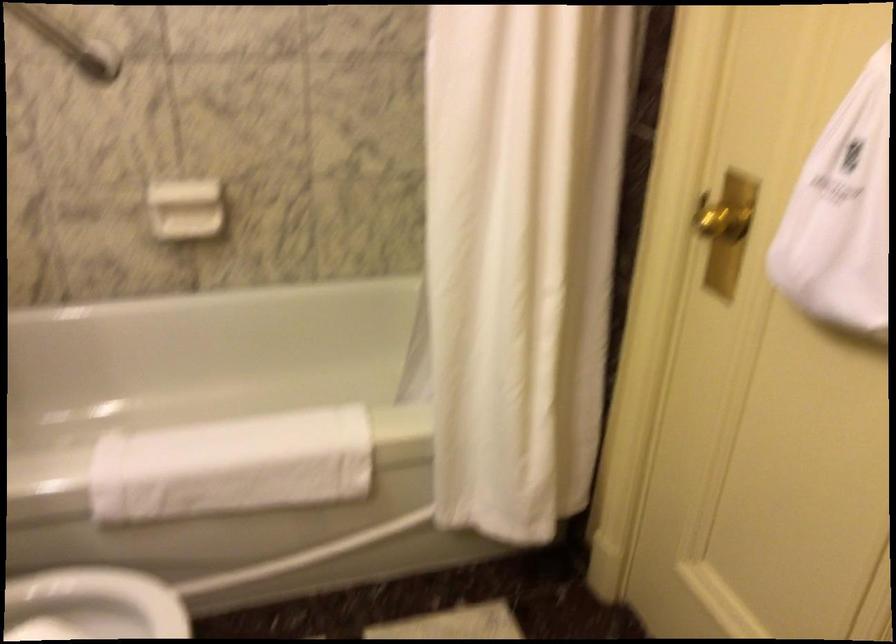
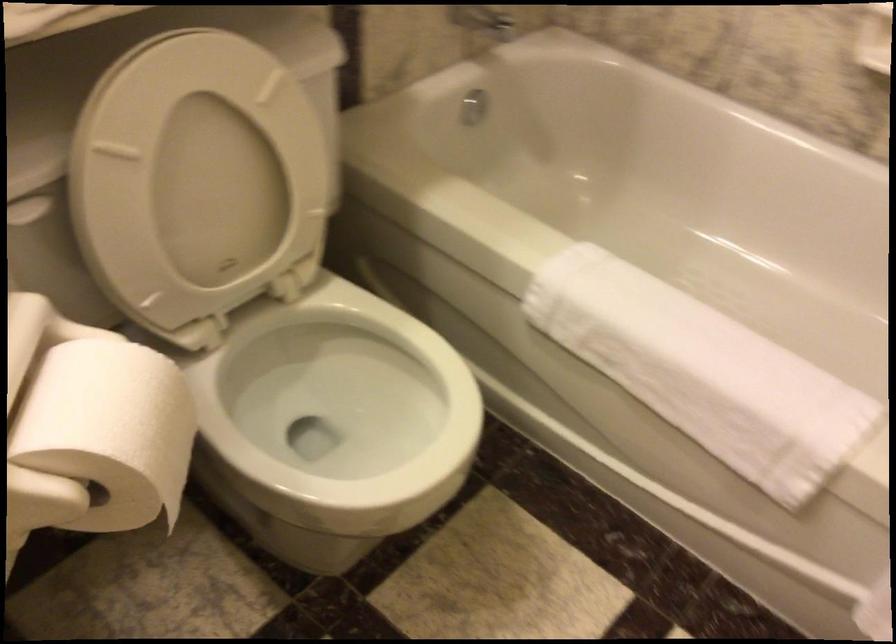
The first image is from the beginning of the video and the second image is from the end. How did the camera likely rotate when shooting the video?

The rotation direction of the camera is left-down.